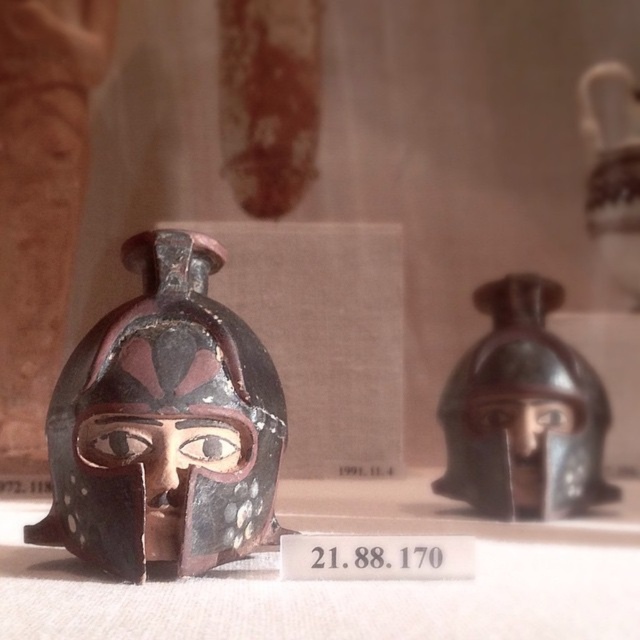
You are a museum curator planning to install a spotlight at point (164, 424). Which helmet will the spotlight illuminate?

The spotlight at point (164, 424) will illuminate the matte black helmet at left.